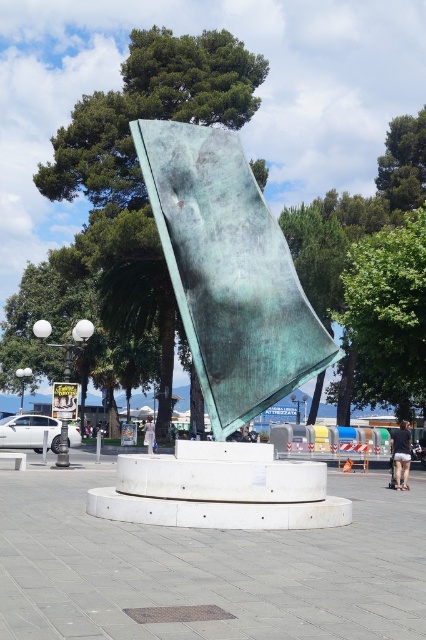
In the scene shown: You are a photographer trying to capture the sculpture in the public square. You notice the green leafy tree at center and the dark gray shorts at lower right in your frame. Which object should you adjust your camera angle to focus on if you want to highlight the larger object in the scene?

The green leafy tree at center is larger than the dark gray shorts at lower right, so you should adjust your camera angle to focus on the green leafy tree at center to highlight the larger object in the scene.

Looking at this image, you are standing in the public square and want to take a photo of the green patina metal at center. Based on its position, where should you position yourself to ensure it is centered in your camera frame?

The green patina metal at center is located at point coordinates (229, 273), so positioning yourself directly in front of its coordinates will center it in your camera frame.

From the picture: You are standing in the public square and want to take a photo of the green leafy tree at center and the dark gray shorts at lower right. Which object should you zoom in on to capture both in the frame without moving your camera?

The green leafy tree at center is narrower than the dark gray shorts at lower right, so you should zoom in on the green leafy tree at center to ensure both fit in the frame.